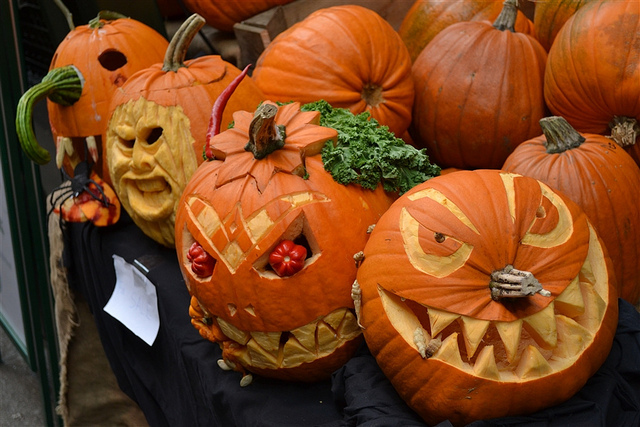
Locate an element on the screen. counter is located at coordinates (338, 391).